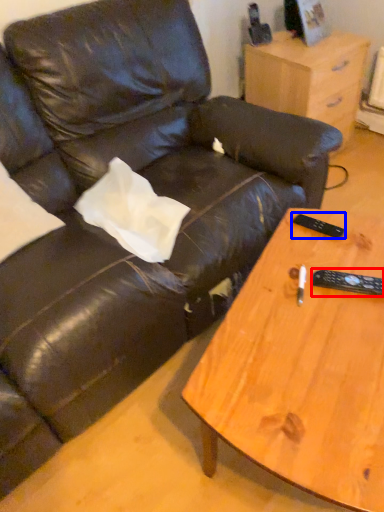
Question: Among these objects, which one is nearest to the camera, remote (highlighted by a red box) or remote (highlighted by a blue box)?

Choices:
 (A) remote
 (B) remote

Answer: (A)